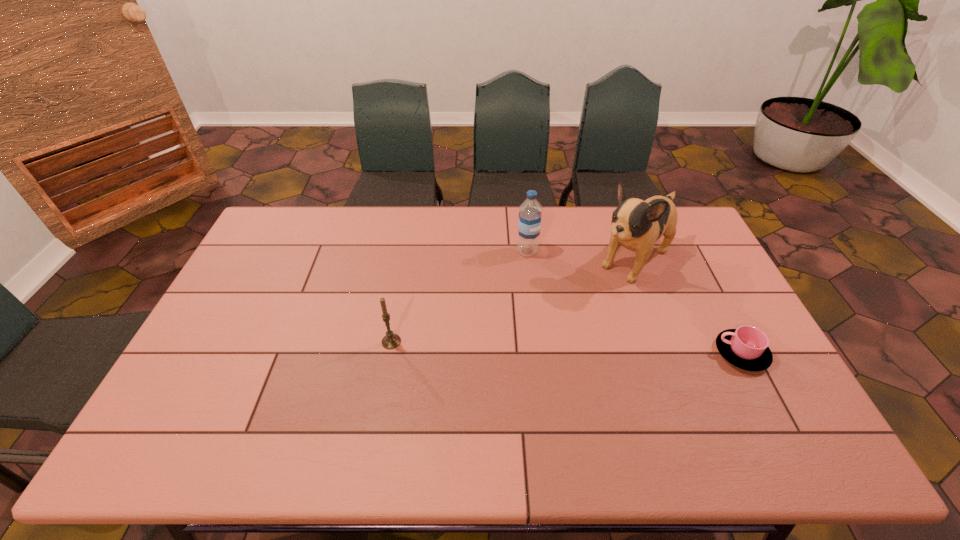
Image resolution: width=960 pixels, height=540 pixels. What are the coordinates of `free location that satisfies the following two spatial constraints: 1. on the back side of the leftmost object; 2. on the right side of the tallest object` in the screenshot? It's located at (406, 259).